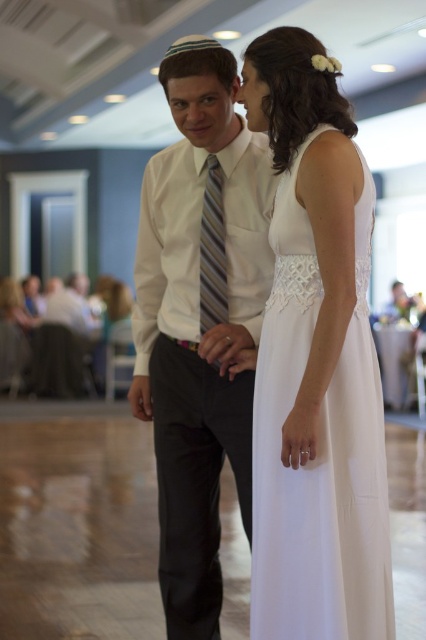
You are standing at the entrance of the banquet hall and want to greet the person wearing the white satin shirt at center. In which direction should you walk to reach them?

The white satin shirt at center is located at point 0.509 on the x axis and 0.469 on the y axis, so you should walk forward and slightly to the right to reach them.

You are a photographer at the wedding reception. You need to capture a closeup shot of the striped fabric tie at center and the white satin shirt at center. Which one is positioned lower in the frame?

The white satin shirt at center is positioned below the striped fabric tie at center, so the white satin shirt at center is lower in the frame.